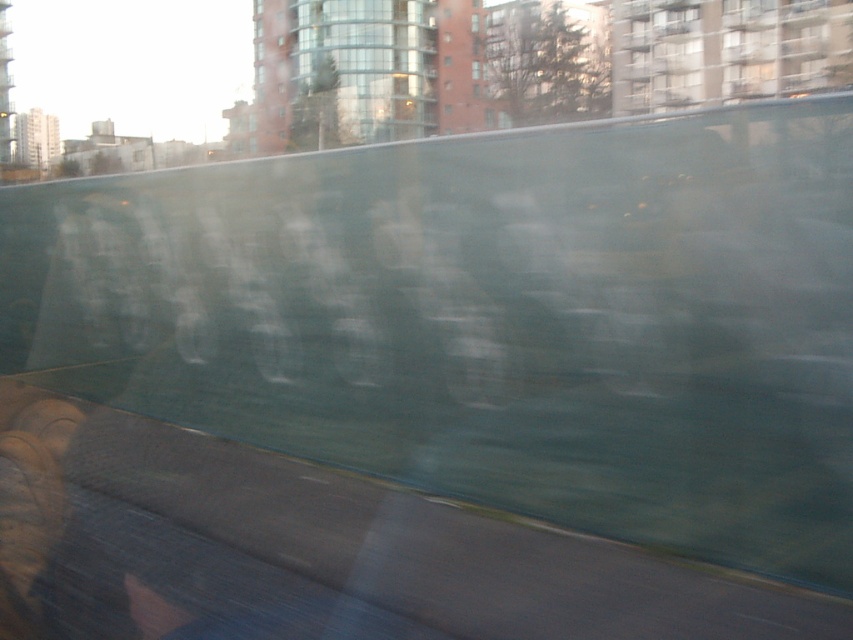
Can you confirm if transparent glass window at upper center is positioned below transparent glass window at center?

No.

Who is more forward, (469, 29) or (480, 72)?

Point (480, 72) is in front.

Locate an element on the screen. This screenshot has height=640, width=853. transparent glass window at upper center is located at coordinates (474, 22).

At what (x,y) coordinates should I click in order to perform the action: click on transparent glass window at upper center. Please return your answer as a coordinate pair (x, y). Looking at the image, I should click on (474, 22).